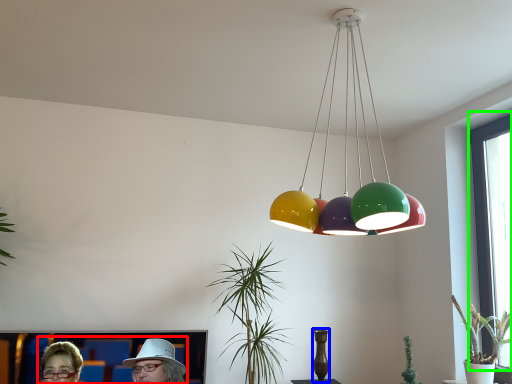
Question: Based on their relative distances, which object is farther from couple (highlighted by a red box)? Choose from vase (highlighted by a blue box) and window screen (highlighted by a green box).

Choices:
 (A) vase
 (B) window screen

Answer: (B)